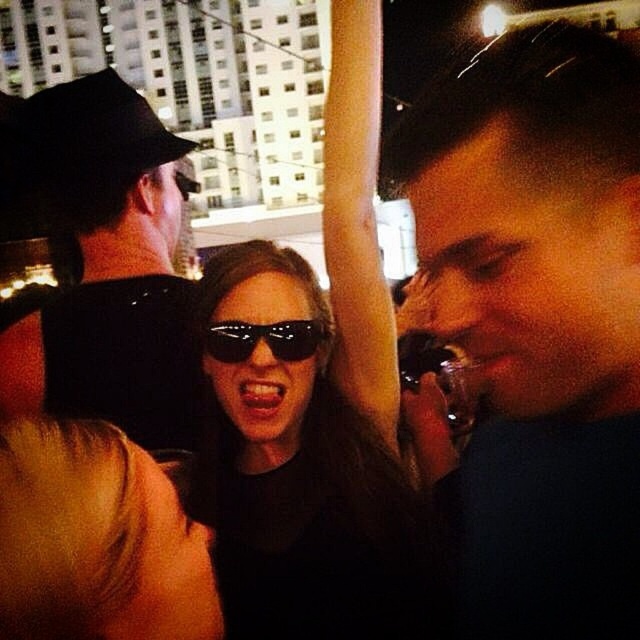
You are a photographer trying to capture a clear shot of both the black matte baseball hat at upper left and the black reflective sunglasses at center. Since you want to focus on the sunglasses, which object should you adjust your camera focus on first?

The black matte baseball hat at upper left is closer to the viewer than the black reflective sunglasses at center. To focus on the sunglasses first, you should adjust your camera focus starting from the sunglasses since they are farther away, ensuring depth of field captures both.

From the picture: You are a photographer trying to capture a clear shot of the black reflective sunglasses at center. However, the black matte baseball hat at upper left is obstructing the view. Can you determine if the hat is wider than the sunglasses?

The black matte baseball hat at upper left might be wider than black reflective sunglasses at center, so there is a possibility that the hat is obstructing the view of the sunglasses.